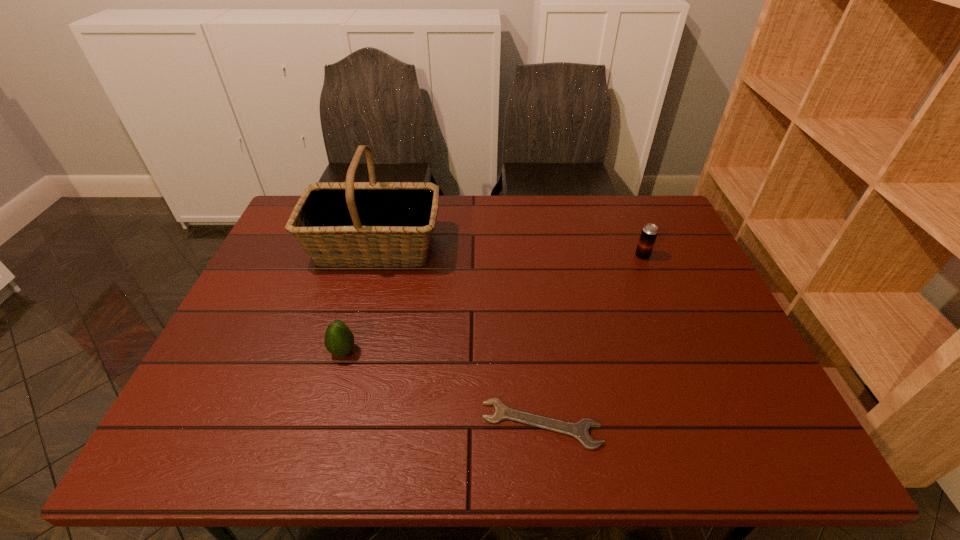
Where is `empty space between the basket and the third object from left to right`? empty space between the basket and the third object from left to right is located at coordinates (458, 335).

What are the coordinates of `unoccupied position between the avocado and the shortest object` in the screenshot? It's located at (443, 388).

You are a GUI agent. You are given a task and a screenshot of the screen. Output one action in this format:
    pyautogui.click(x=<x>, y=<y>)
    Task: Click on the vacant region between the basket and the avocado
    
    Given the screenshot: What is the action you would take?
    pyautogui.click(x=359, y=300)

Locate an element on the screen. The width and height of the screenshot is (960, 540). vacant space that's between the tallest object and the third object from left to right is located at coordinates (458, 335).

Identify the location of free area in between the tallest object and the rightmost object. The width and height of the screenshot is (960, 540). (509, 252).

I want to click on vacant space that's between the tallest object and the avocado, so click(359, 300).

Locate an element on the screen. vacant area between the third object from left to right and the beer can is located at coordinates (591, 340).

The width and height of the screenshot is (960, 540). I want to click on free spot between the avocado and the tallest object, so click(x=359, y=300).

Locate an element on the screen. This screenshot has width=960, height=540. free spot between the wrench and the rightmost object is located at coordinates (591, 340).

The image size is (960, 540). I want to click on blank region between the tallest object and the second nearest object, so click(359, 300).